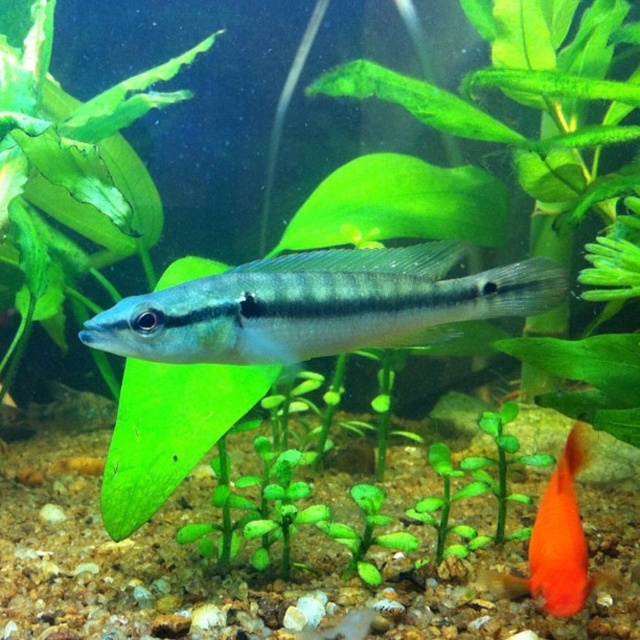
Who is positioned more to the left, satin silver fish at center or orange glossy fish at lower right?

Positioned to the left is satin silver fish at center.

Between satin silver fish at center and orange glossy fish at lower right, which one has less height?

With less height is satin silver fish at center.

The image size is (640, 640). I want to click on satin silver fish at center, so click(x=317, y=305).